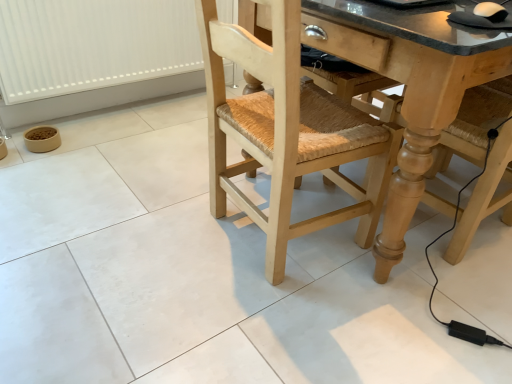
Question: From a real-world perspective, is white plastic radiator at lower left physically above natural wood chair at center?

Choices:
 (A) yes
 (B) no

Answer: (B)

Question: Is white plastic radiator at lower left positioned before natural wood chair at center?

Choices:
 (A) yes
 (B) no

Answer: (B)

Question: Is natural wood chair at center inside white plastic radiator at lower left?

Choices:
 (A) yes
 (B) no

Answer: (B)

Question: Is white plastic radiator at lower left looking in the opposite direction of natural wood chair at center?

Choices:
 (A) yes
 (B) no

Answer: (B)

Question: Is white plastic radiator at lower left next to natural wood chair at center and touching it?

Choices:
 (A) no
 (B) yes

Answer: (A)

Question: Is white plastic radiator at lower left at the right side of natural wood chair at center?

Choices:
 (A) yes
 (B) no

Answer: (B)

Question: Is granite countertop at center in front of white plastic radiator at lower left?

Choices:
 (A) no
 (B) yes

Answer: (B)

Question: Is granite countertop at center far from white plastic radiator at lower left?

Choices:
 (A) no
 (B) yes

Answer: (B)

Question: Does granite countertop at center turn towards white plastic radiator at lower left?

Choices:
 (A) no
 (B) yes

Answer: (A)

Question: Is granite countertop at center positioned beyond the bounds of white plastic radiator at lower left?

Choices:
 (A) yes
 (B) no

Answer: (A)

Question: Are granite countertop at center and white plastic radiator at lower left beside each other?

Choices:
 (A) no
 (B) yes

Answer: (A)

Question: Does granite countertop at center appear on the right side of white plastic radiator at lower left?

Choices:
 (A) yes
 (B) no

Answer: (A)

Question: Is granite countertop at center facing away from natural wood chair at center?

Choices:
 (A) no
 (B) yes

Answer: (A)